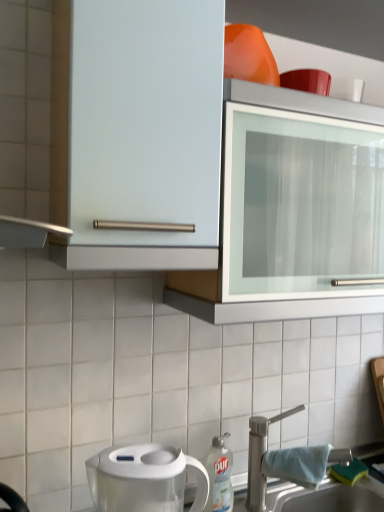
Locate an element on the screen. Image resolution: width=384 pixels, height=512 pixels. free space above transparent plastic water filter pitcher at lower left (from a real-world perspective) is located at coordinates (139, 456).